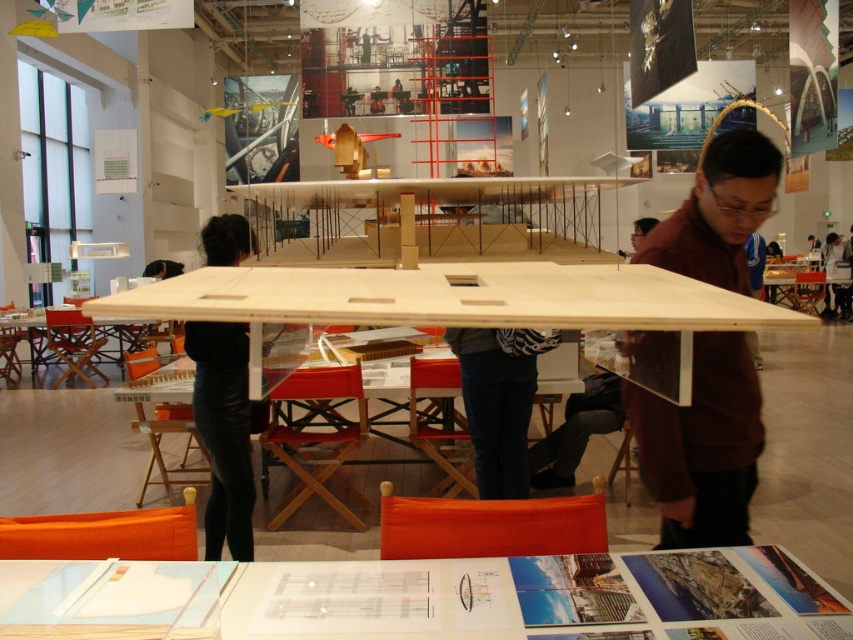
Question: Among these points, which one is farthest from the camera?

Choices:
 (A) (148, 573)
 (B) (241, 483)
 (C) (360, 300)

Answer: (B)

Question: Can you confirm if denim pants at center is thinner than white shirt at center?

Choices:
 (A) no
 (B) yes

Answer: (B)

Question: Which object appears farthest from the camera in this image?

Choices:
 (A) wooden table at center
 (B) white paper at center
 (C) brown sweater at upper right
 (D) black leather pants at center

Answer: (D)

Question: Observing the image, what is the correct spatial positioning of denim pants at center in reference to white shirt at center?

Choices:
 (A) right
 (B) left

Answer: (B)

Question: Is brown sweater at upper right to the left of black leather pants at center from the viewer's perspective?

Choices:
 (A) yes
 (B) no

Answer: (B)

Question: Which point is farther from the camera taking this photo?

Choices:
 (A) 230,259
 (B) 485,436
 (C) 517,323

Answer: (B)